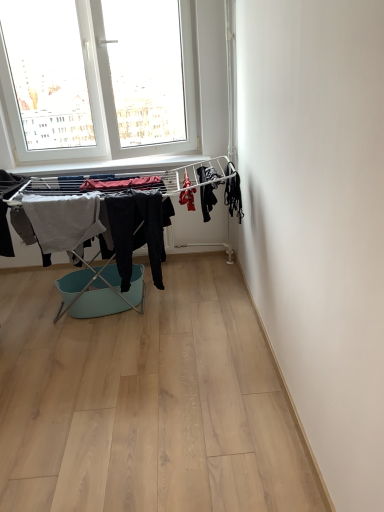
You are a GUI agent. You are given a task and a screenshot of the screen. Output one action in this format:
    pyautogui.click(x=<x>, y=<y>)
    Task: Click on the black matte fabric at right, which ranks as the fifth clothing in left-to-right order
    The image size is (384, 512).
    Given the screenshot: What is the action you would take?
    pyautogui.click(x=233, y=192)

The width and height of the screenshot is (384, 512). Describe the element at coordinates (207, 200) in the screenshot. I see `dark gray fabric at center, the 2th clothing in the right-to-left sequence` at that location.

Identify the location of black matte fabric at right, which ranks as the fifth clothing in left-to-right order. (233, 192).

Which is more to the left, light gray cotton towel at left, which is counted as the 5th clothing, starting from the right, or dark gray fabric at center, the 2th clothing in the right-to-left sequence?

Positioned to the left is light gray cotton towel at left, which is counted as the 5th clothing, starting from the right.

Is light gray cotton towel at left, which is counted as the 5th clothing, starting from the right, placed right next to dark gray fabric at center, the 2th clothing in the right-to-left sequence?

No, light gray cotton towel at left, which is counted as the 5th clothing, starting from the right, is not in contact with dark gray fabric at center, the 2th clothing in the right-to-left sequence.

Does point (69, 230) come behind point (200, 187)?

No.

Considering their positions, is light gray cotton towel at left, which is counted as the 5th clothing, starting from the right, located in front of or behind dark gray fabric at center, the 2th clothing in the right-to-left sequence?

light gray cotton towel at left, which is counted as the 5th clothing, starting from the right, is behind dark gray fabric at center, the 2th clothing in the right-to-left sequence.

From a real-world perspective, is dark gray fabric pants at center, which is the second clothing in left-to-right order, located beneath black matte fabric at right, which ranks as the fifth clothing in left-to-right order?

Yes, from a real-world perspective, dark gray fabric pants at center, which is the second clothing in left-to-right order, is under black matte fabric at right, which ranks as the fifth clothing in left-to-right order.

Does point (162, 250) lie behind point (229, 189)?

Yes, it is behind point (229, 189).

Looking at this image, visually, is dark gray fabric pants at center, which is the second clothing in left-to-right order, positioned to the left or to the right of black matte fabric at right, which ranks as the first clothing in right-to-left order?

From the image, it's evident that dark gray fabric pants at center, which is the second clothing in left-to-right order, is to the left of black matte fabric at right, which ranks as the first clothing in right-to-left order.

Does dark gray fabric pants at center, which is the second clothing in left-to-right order, have a larger size compared to black matte fabric at right, which ranks as the first clothing in right-to-left order?

Yes.

Which is correct: dark gray fabric at center, placed as the 4th clothing when sorted from left to right, is inside dark gray fabric pants at center, the 4th clothing in the right-to-left sequence, or outside of it?

dark gray fabric at center, placed as the 4th clothing when sorted from left to right, cannot be found inside dark gray fabric pants at center, the 4th clothing in the right-to-left sequence.

From the image's perspective, which one is positioned higher, dark gray fabric at center, placed as the 4th clothing when sorted from left to right, or dark gray fabric pants at center, which is the second clothing in left-to-right order?

dark gray fabric at center, placed as the 4th clothing when sorted from left to right, from the image's perspective.

Is dark gray fabric at center, placed as the 4th clothing when sorted from left to right, beside dark gray fabric pants at center, the 4th clothing in the right-to-left sequence?

No, dark gray fabric at center, placed as the 4th clothing when sorted from left to right, is not in contact with dark gray fabric pants at center, the 4th clothing in the right-to-left sequence.

Who is taller, dark gray fabric at center, the 2th clothing in the right-to-left sequence, or dark gray fabric pants at center, which is the second clothing in left-to-right order?

Standing taller between the two is dark gray fabric pants at center, which is the second clothing in left-to-right order.

Does black matte fabric at right, which ranks as the fifth clothing in left-to-right order, have a smaller size compared to red fabric at center, the 3th clothing positioned from the left?

Yes.

From a real-world perspective, between black matte fabric at right, which ranks as the first clothing in right-to-left order, and red fabric at center, the 3th clothing positioned from the left, who is vertically higher?

In real-world perspective, black matte fabric at right, which ranks as the first clothing in right-to-left order, is above.

Which is more to the left, black matte fabric at right, which ranks as the first clothing in right-to-left order, or red fabric at center, the 3th clothing positioned from the left?

red fabric at center, the 3th clothing positioned from the left.

Can you confirm if black matte fabric at right, which ranks as the fifth clothing in left-to-right order, is positioned to the left of mint plastic laundry basket at center?

In fact, black matte fabric at right, which ranks as the fifth clothing in left-to-right order, is to the right of mint plastic laundry basket at center.

From the image's perspective, is black matte fabric at right, which ranks as the first clothing in right-to-left order, above mint plastic laundry basket at center?

Yes, from the image's perspective, black matte fabric at right, which ranks as the first clothing in right-to-left order, is above mint plastic laundry basket at center.

Looking at this image, from a real-world perspective, is black matte fabric at right, which ranks as the first clothing in right-to-left order, above or below mint plastic laundry basket at center?

black matte fabric at right, which ranks as the first clothing in right-to-left order, is situated higher than mint plastic laundry basket at center in the real world.

Between black matte fabric at right, which ranks as the fifth clothing in left-to-right order, and mint plastic laundry basket at center, which one has smaller size?

With smaller size is black matte fabric at right, which ranks as the fifth clothing in left-to-right order.

Considering the relative sizes of dark gray fabric pants at center, which is the second clothing in left-to-right order, and red fabric at center, which is the third clothing from right to left, in the image provided, is dark gray fabric pants at center, which is the second clothing in left-to-right order, thinner than red fabric at center, which is the third clothing from right to left,?

No, dark gray fabric pants at center, which is the second clothing in left-to-right order, is not thinner than red fabric at center, which is the third clothing from right to left.

Can we say dark gray fabric pants at center, which is the second clothing in left-to-right order, lies outside red fabric at center, the 3th clothing positioned from the left?

Yes, dark gray fabric pants at center, which is the second clothing in left-to-right order, is not within red fabric at center, the 3th clothing positioned from the left.

From the image's perspective, who appears lower, dark gray fabric pants at center, which is the second clothing in left-to-right order, or red fabric at center, which is the third clothing from right to left?

dark gray fabric pants at center, which is the second clothing in left-to-right order, is shown below in the image.

Starting from the red fabric at center, which is the third clothing from right to left, which clothing is the 3rd one in front? Please provide its 2D coordinates.

[(137, 232)]

Could you tell me if light gray cotton towel at left, the 1th clothing when ordered from left to right, is turned towards dark gray fabric pants at center, which is the second clothing in left-to-right order?

No, light gray cotton towel at left, the 1th clothing when ordered from left to right, does not turn towards dark gray fabric pants at center, which is the second clothing in left-to-right order.

From the image's perspective, is light gray cotton towel at left, the 1th clothing when ordered from left to right, above dark gray fabric pants at center, the 4th clothing in the right-to-left sequence?

Correct, light gray cotton towel at left, the 1th clothing when ordered from left to right, appears higher than dark gray fabric pants at center, the 4th clothing in the right-to-left sequence, in the image.

In the scene shown: How many degrees apart are the facing directions of light gray cotton towel at left, the 1th clothing when ordered from left to right, and dark gray fabric pants at center, the 4th clothing in the right-to-left sequence?

The angular difference between light gray cotton towel at left, the 1th clothing when ordered from left to right, and dark gray fabric pants at center, the 4th clothing in the right-to-left sequence, is 0.000846 degrees.

Image resolution: width=384 pixels, height=512 pixels. What are the coordinates of `clothing that is the 4th object located behind the dark gray fabric pants at center, the 4th clothing in the right-to-left sequence` in the screenshot? It's located at (64, 221).

Which clothing is the 3rd one when counting from the left side of the dark gray fabric at center, placed as the 4th clothing when sorted from left to right? Please provide its 2D coordinates.

[(64, 221)]

Identify the location of the 3rd clothing counting from the right of the dark gray fabric pants at center, the 4th clothing in the right-to-left sequence. This screenshot has width=384, height=512. (233, 192).

Estimate the real-world distances between objects in this image. Which object is closer to dark gray fabric at center, placed as the 4th clothing when sorted from left to right, red fabric at center, the 3th clothing positioned from the left, or light gray cotton towel at left, the 1th clothing when ordered from left to right?

Among the two, red fabric at center, the 3th clothing positioned from the left, is located nearer to dark gray fabric at center, placed as the 4th clothing when sorted from left to right.

When comparing their distances from mint plastic laundry basket at center, does dark gray fabric pants at center, which is the second clothing in left-to-right order, or dark gray fabric at center, placed as the 4th clothing when sorted from left to right, seem closer?

dark gray fabric pants at center, which is the second clothing in left-to-right order, is closer to mint plastic laundry basket at center.

Estimate the real-world distances between objects in this image. Which object is further from dark gray fabric at center, the 2th clothing in the right-to-left sequence, mint plastic laundry basket at center or black matte fabric at right, which ranks as the first clothing in right-to-left order?

mint plastic laundry basket at center is positioned further to the anchor dark gray fabric at center, the 2th clothing in the right-to-left sequence.

Considering their positions, is mint plastic laundry basket at center positioned closer to dark gray fabric at center, placed as the 4th clothing when sorted from left to right, than red fabric at center, which is the third clothing from right to left?

Based on the image, red fabric at center, which is the third clothing from right to left, appears to be nearer to dark gray fabric at center, placed as the 4th clothing when sorted from left to right.

When comparing their distances from dark gray fabric pants at center, the 4th clothing in the right-to-left sequence, does red fabric at center, the 3th clothing positioned from the left, or light gray cotton towel at left, the 1th clothing when ordered from left to right, seem closer?

light gray cotton towel at left, the 1th clothing when ordered from left to right, lies closer to dark gray fabric pants at center, the 4th clothing in the right-to-left sequence, than the other object.

Looking at the image, which one is located further to light gray cotton towel at left, the 1th clothing when ordered from left to right, mint plastic laundry basket at center or dark gray fabric pants at center, the 4th clothing in the right-to-left sequence?

mint plastic laundry basket at center is further to light gray cotton towel at left, the 1th clothing when ordered from left to right.

Estimate the real-world distances between objects in this image. Which object is closer to dark gray fabric at center, the 2th clothing in the right-to-left sequence, mint plastic laundry basket at center or light gray cotton towel at left, the 1th clothing when ordered from left to right?

mint plastic laundry basket at center is positioned closer to the anchor dark gray fabric at center, the 2th clothing in the right-to-left sequence.

Considering their positions, is dark gray fabric at center, placed as the 4th clothing when sorted from left to right, positioned further to light gray cotton towel at left, the 1th clothing when ordered from left to right, than dark gray fabric pants at center, which is the second clothing in left-to-right order?

dark gray fabric at center, placed as the 4th clothing when sorted from left to right, is positioned further to the anchor light gray cotton towel at left, the 1th clothing when ordered from left to right.

I want to click on laundry basket between light gray cotton towel at left, which is counted as the 5th clothing, starting from the right, and red fabric at center, which is the third clothing from right to left, in the horizontal direction, so click(99, 292).

This screenshot has height=512, width=384. What are the coordinates of `laundry basket between light gray cotton towel at left, the 1th clothing when ordered from left to right, and black matte fabric at right, which ranks as the fifth clothing in left-to-right order, from left to right` in the screenshot? It's located at (99, 292).

Locate an element on the screen. The height and width of the screenshot is (512, 384). clothing between light gray cotton towel at left, which is counted as the 5th clothing, starting from the right, and red fabric at center, the 3th clothing positioned from the left, in the horizontal direction is located at coordinates (137, 232).

Locate an element on the screen. The image size is (384, 512). clothing situated between dark gray fabric pants at center, which is the second clothing in left-to-right order, and dark gray fabric at center, the 2th clothing in the right-to-left sequence, from left to right is located at coordinates (187, 199).